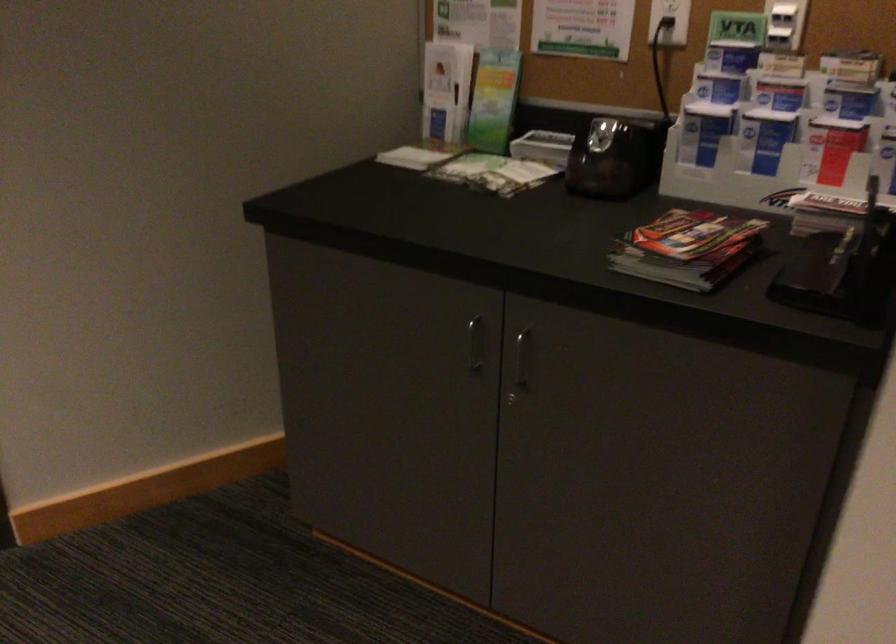
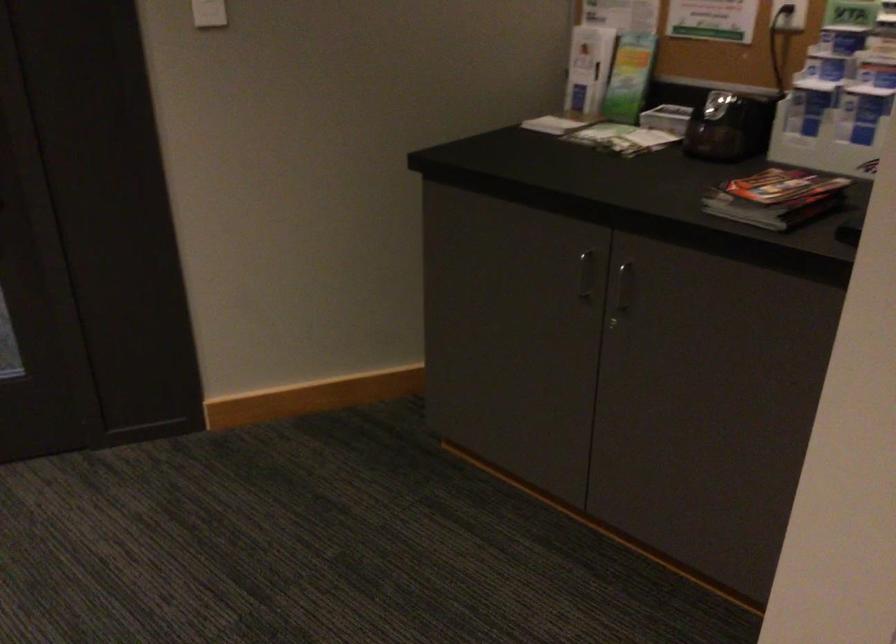
In the second image, find the point that corresponds to point 526,174 in the first image.

(647, 140)